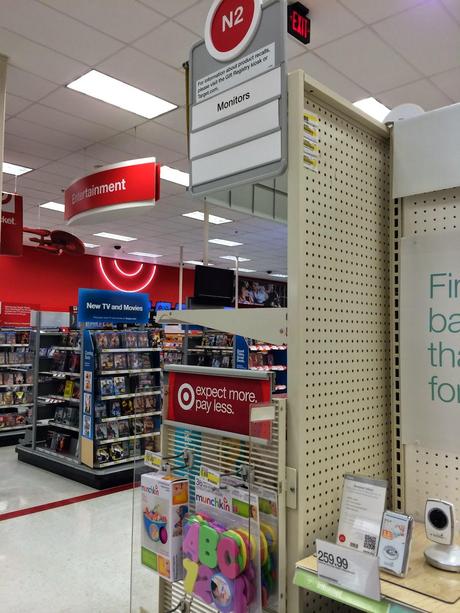
You are a GUI agent. You are given a task and a screenshot of the screen. Output one action in this format:
    pyautogui.click(x=<x>, y=<y>)
    Task: Click on the emergency exit sign
    Image resolution: width=460 pixels, height=613 pixels.
    Given the screenshot: What is the action you would take?
    pyautogui.click(x=298, y=24)